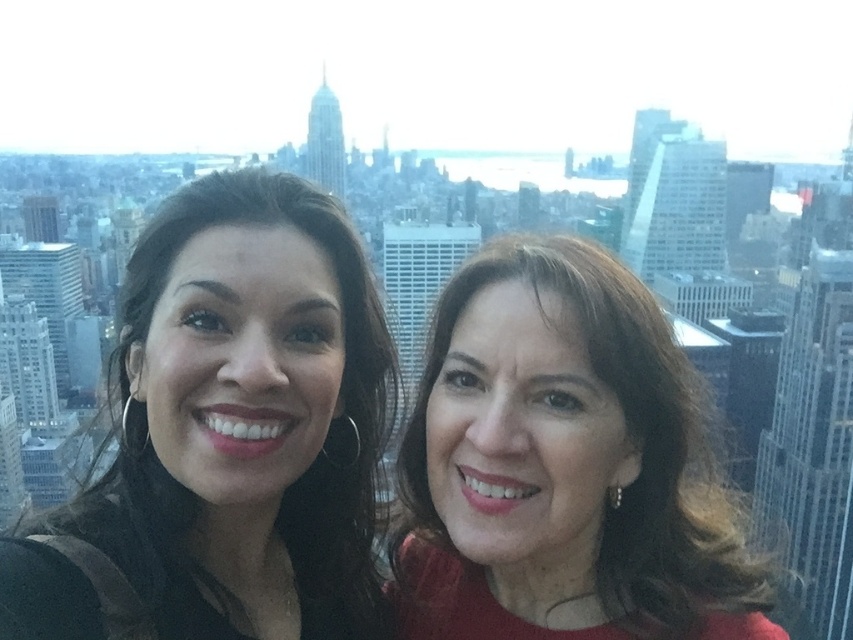
Does matte black hair at center appear on the right side of matte red dress at center?

In fact, matte black hair at center is to the left of matte red dress at center.

Does matte black hair at center have a lesser width compared to matte red dress at center?

Correct, matte black hair at center's width is less than matte red dress at center's.

Is point (210, 186) less distant than point (711, 477)?

Yes, it is in front of point (711, 477).

This screenshot has height=640, width=853. Find the location of `matte black hair at center`. matte black hair at center is located at coordinates (227, 436).